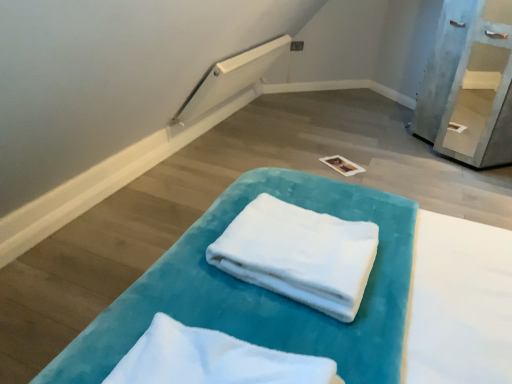
Question: In the image, is white soft towel at center, placed as the first cloth when sorted from back to front, on the left side or the right side of white soft towel at center, which appears as the 2th cloth when viewed from the back?

Choices:
 (A) right
 (B) left

Answer: (A)

Question: Is white soft towel at center, the second cloth in the front-to-back sequence, inside or outside of white soft towel at center, which appears as the 2th cloth when viewed from the back?

Choices:
 (A) outside
 (B) inside

Answer: (A)

Question: Based on their relative distances, which object is nearer to the light blue painted wood shelf at upper right?

Choices:
 (A) white soft towel at center, placed as the first cloth when sorted from back to front
 (B) white soft towel at center, which is counted as the 1th cloth, starting from the front
 (C) velvet teal towel at center

Answer: (C)

Question: Which object is positioned closest to the white soft towel at center, which appears as the 2th cloth when viewed from the back?

Choices:
 (A) white soft towel at center, placed as the first cloth when sorted from back to front
 (B) velvet teal towel at center
 (C) light blue painted wood shelf at upper right

Answer: (B)